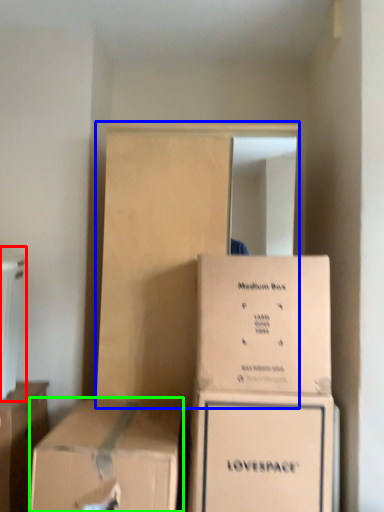
Question: Which is farther away from appliance (highlighted by a red box)? dresser (highlighted by a blue box) or box (highlighted by a green box)?

Choices:
 (A) dresser
 (B) box

Answer: (B)